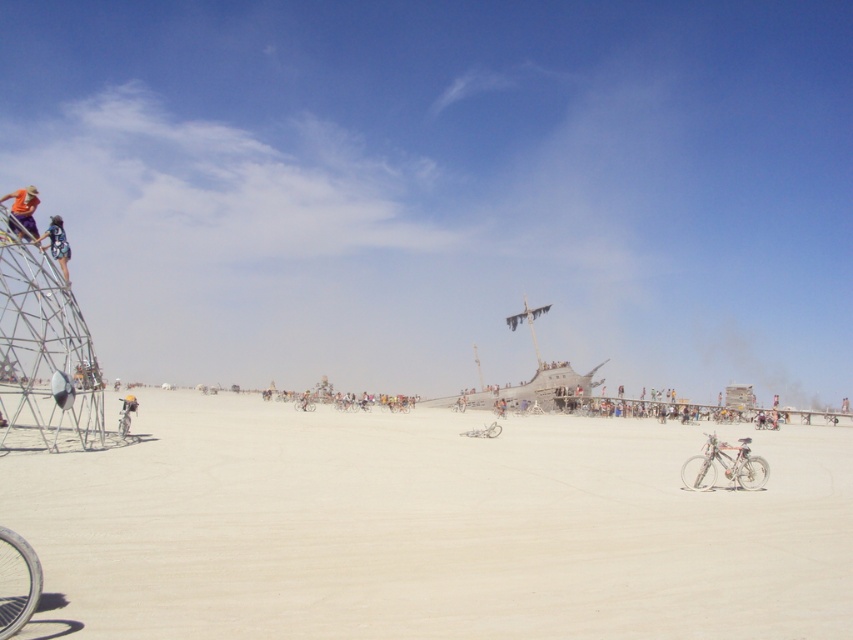
Question: Which point is closer to the camera?

Choices:
 (A) (125, 432)
 (B) (689, 483)

Answer: (B)

Question: Is blue denim shorts at left positioned behind metallic silver bicycle at center?

Choices:
 (A) yes
 (B) no

Answer: (B)

Question: Estimate the real-world distances between objects in this image. Which object is farther from the white sand dirt track at center?

Choices:
 (A) yellow helmeted person at center
 (B) silver metallic bicycle at lower right
 (C) metallic silver bicycle at center
 (D) blue denim shorts at left

Answer: (D)

Question: Does orange fabric at left appear under silver metallic bicycle at lower left?

Choices:
 (A) yes
 (B) no

Answer: (B)

Question: Which point is closer to the camera taking this photo?

Choices:
 (A) (32, 188)
 (B) (48, 234)
 (C) (759, 481)
 (D) (132, 397)

Answer: (C)

Question: Is orange fabric at left to the left of metallic silver bicycle at center from the viewer's perspective?

Choices:
 (A) no
 (B) yes

Answer: (B)